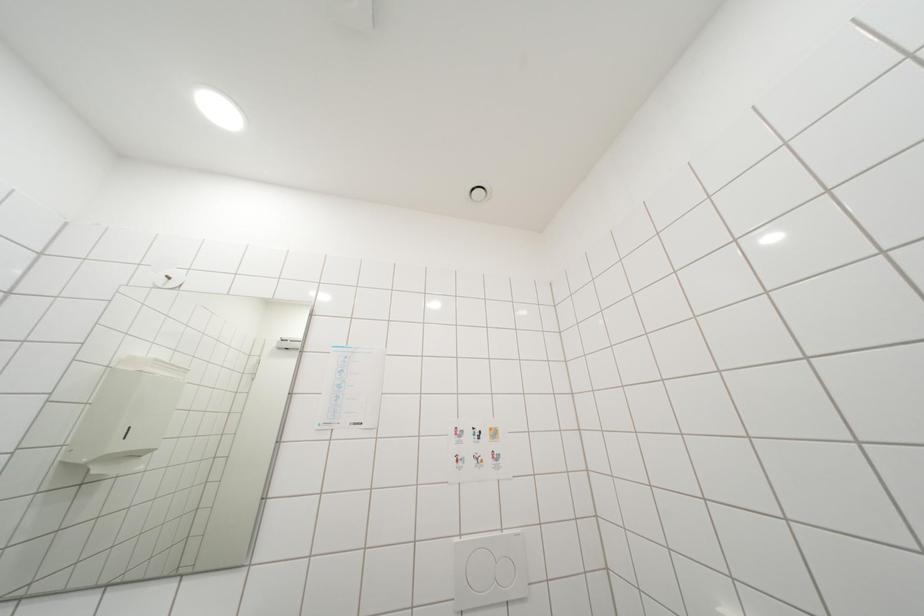
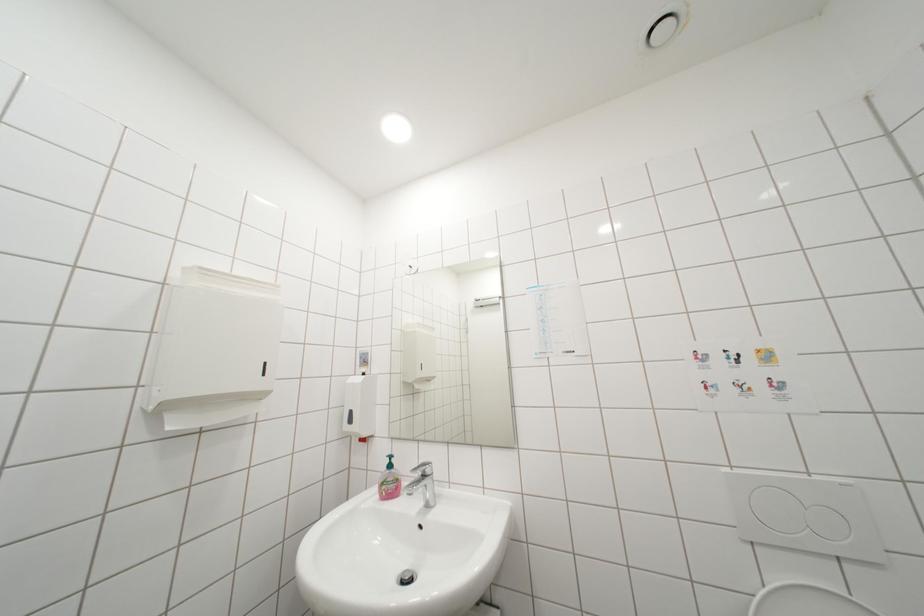
Question: How did the camera likely rotate?

Choices:
 (A) Left
 (B) Right
 (C) Up
 (D) Down

Answer: (A)